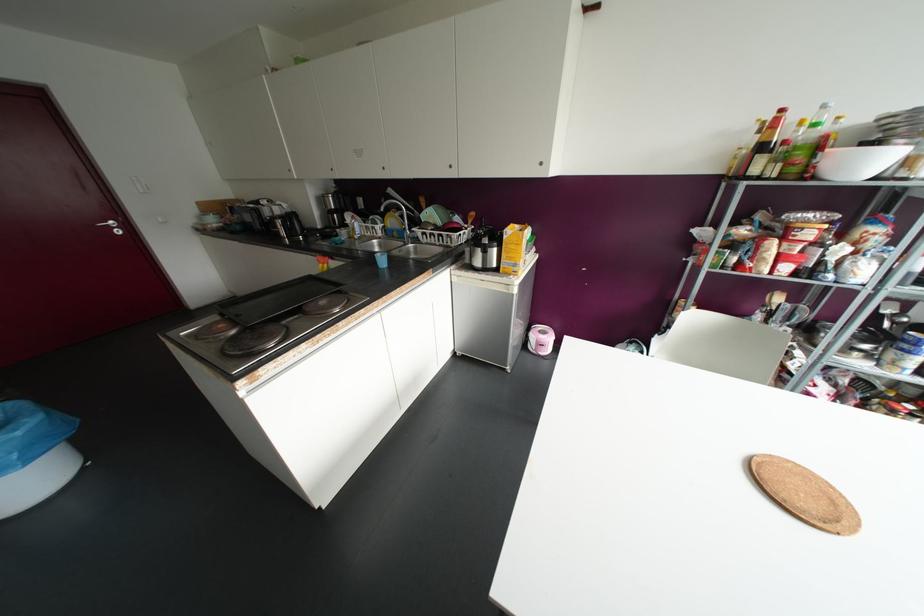
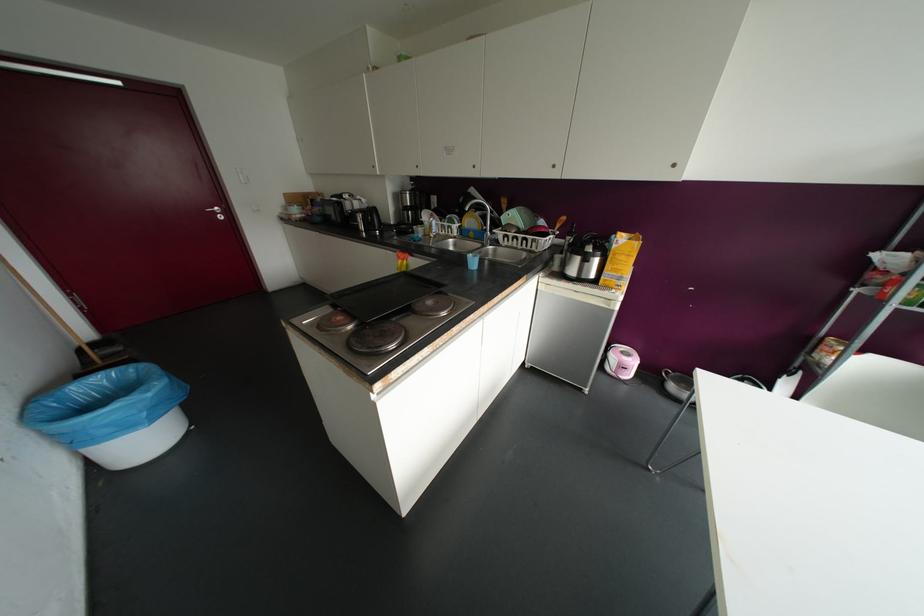
Where in the second image is the point corresponding to point 541,163 from the first image?

(673, 164)